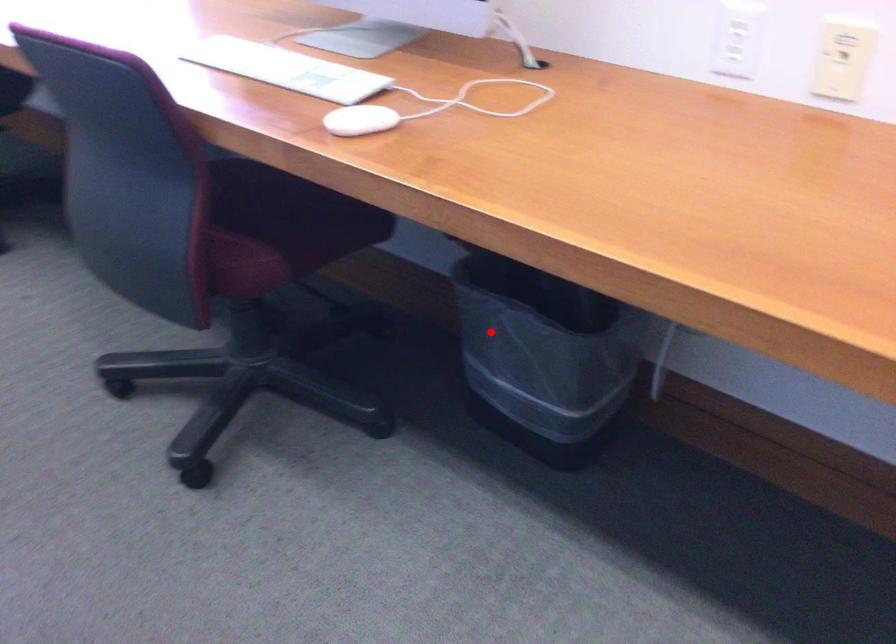
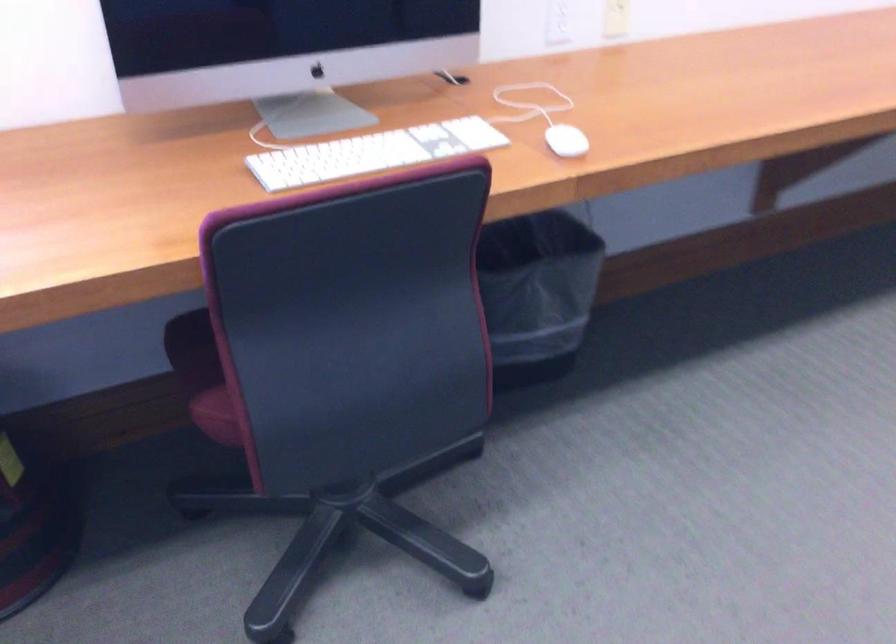
Find the pixel in the second image that matches the highlighted location in the first image.

(536, 292)